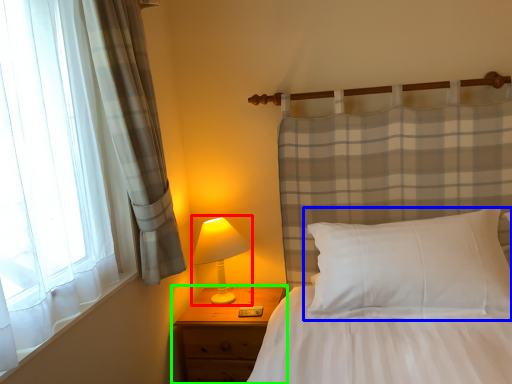
Question: Based on their relative distances, which object is nearer to table lamp (highlighted by a red box)? Choose from pillow (highlighted by a blue box) and nightstand (highlighted by a green box).

Choices:
 (A) pillow
 (B) nightstand

Answer: (B)